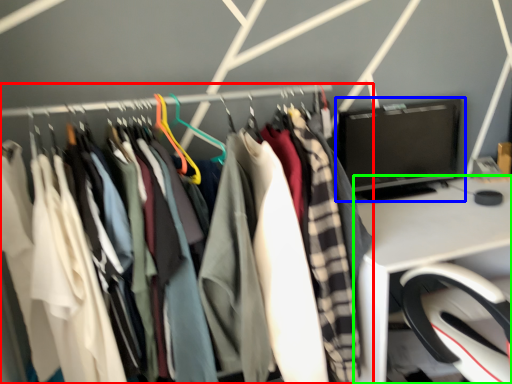
Question: Which object is positioned farthest from closet (highlighted by a red box)? Select from computer monitor (highlighted by a blue box) and desk (highlighted by a green box).

Choices:
 (A) computer monitor
 (B) desk

Answer: (A)